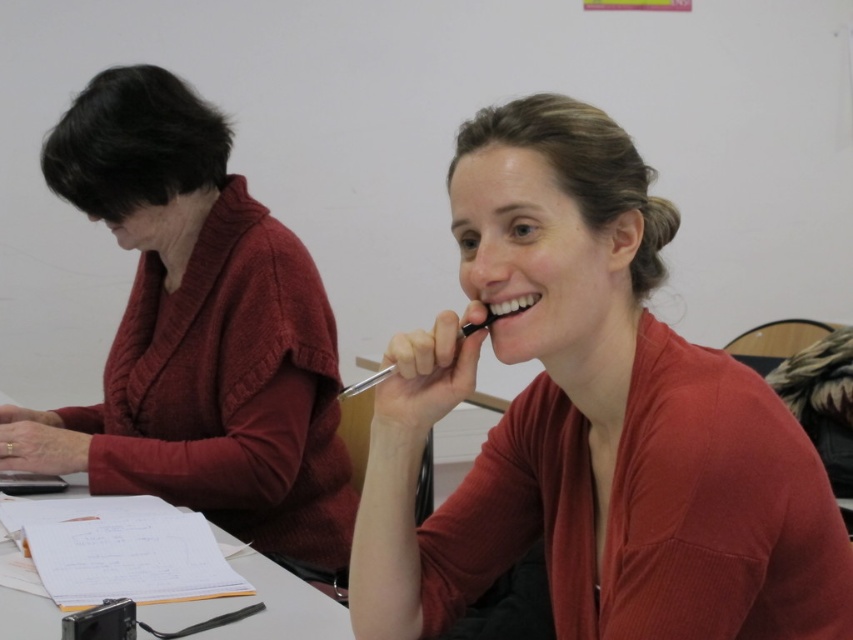
You are standing at the point marked as point (x=84, y=168) in a classroom. You want to walk to the door located at the opposite end of the room. If your walking speed is 3 feet per second, how many seconds will it take you to reach the door?

The distance between point (x=84, y=168) and the viewer is 4.82 feet. Assuming the door is at the viewer location, it would take 4.82 divided by 3 equals approximately 1.61 seconds to reach the door.

You are organizing a photo shoot and need to ensure that the matte red sweater at center and the white paper at center are both visible in the frame. Given their sizes, which object should you focus on to ensure both are in the shot?

The matte red sweater at center is much taller than the white paper at center, so focusing on the matte red sweater at center will help ensure both objects are visible in the frame.